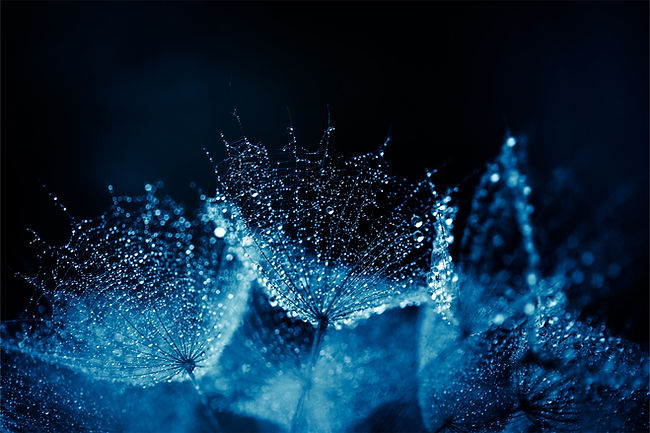
Where is `plant`? Image resolution: width=650 pixels, height=433 pixels. plant is located at coordinates (318, 323).